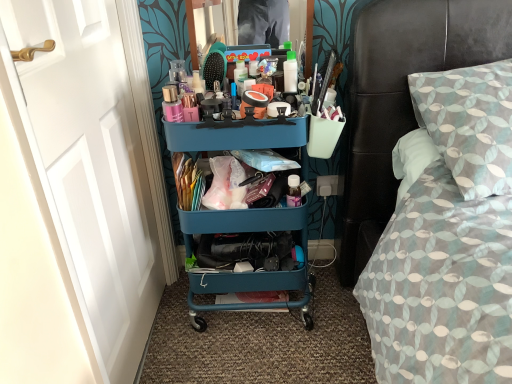
Question: In the image, is teal plastic cart at center on the left side or the right side of patterned fabric bed at right?

Choices:
 (A) right
 (B) left

Answer: (B)

Question: Is teal plastic cart at center inside or outside of patterned fabric bed at right?

Choices:
 (A) inside
 (B) outside

Answer: (B)

Question: Considering the real-world distances, which object is farthest from the white painted wood door at left?

Choices:
 (A) teal plastic cart at center
 (B) patterned fabric bed at right
 (C) white plastic power outlet at lower center

Answer: (C)

Question: Considering the real-world distances, which object is closest to the teal plastic cart at center?

Choices:
 (A) patterned fabric bed at right
 (B) white painted wood door at left
 (C) white plastic power outlet at lower center

Answer: (B)